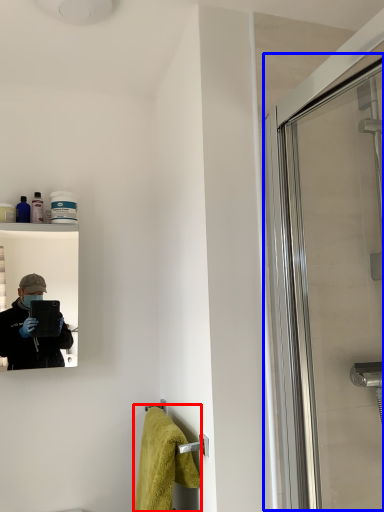
Question: Which object is further to the camera taking this photo, bath towel (highlighted by a red box) or screen door (highlighted by a blue box)?

Choices:
 (A) bath towel
 (B) screen door

Answer: (A)